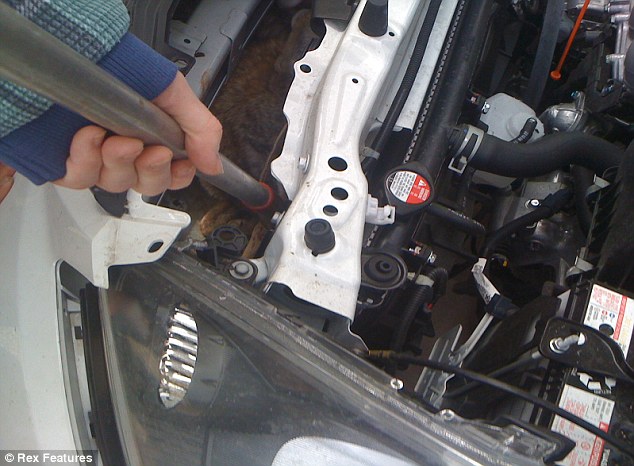
The height and width of the screenshot is (466, 634). In order to click on black cable in this screenshot , I will do `click(510, 385)`.